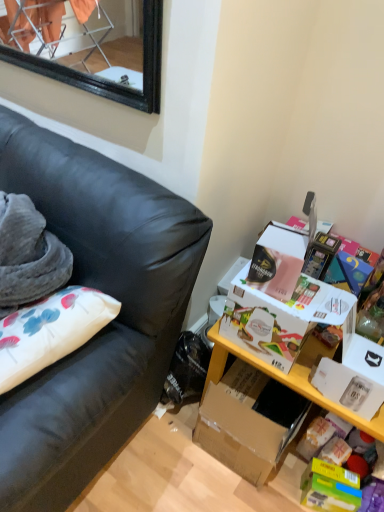
Describe the element at coordinates (106, 326) in the screenshot. Image resolution: width=384 pixels, height=512 pixels. I see `black leather couch at left` at that location.

You are a GUI agent. You are given a task and a screenshot of the screen. Output one action in this format:
    pyautogui.click(x=<x>, y=<y>)
    Task: Click on the white cardboard box at right
    Image resolution: width=384 pixels, height=512 pixels.
    Given the screenshot: What is the action you would take?
    pyautogui.click(x=280, y=317)

Is point (109, 281) closer or farther from the camera than point (254, 345)?

Clearly, point (109, 281) is closer to the camera than point (254, 345).

Is white cardboard box at right inside black leather couch at left?

No.

This screenshot has height=512, width=384. What are the coordinates of `storage box that appears below the black leather couch at left (from the image's perspective)` in the screenshot? It's located at (280, 317).

Is black leather couch at left oriented towards white cardboard box at right?

No, black leather couch at left is not facing towards white cardboard box at right.

Do you think black leather couch at left is within yellow wood table at lower right, or outside of it?

The correct answer is: outside.

Locate an element on the screen. This screenshot has height=512, width=384. table that is below the black leather couch at left (from the image's perspective) is located at coordinates (285, 382).

From the image's perspective, would you say black leather couch at left is shown under yellow wood table at lower right?

Incorrect, from the image's perspective, black leather couch at left is higher than yellow wood table at lower right.

Considering the positions of point (252, 340) and point (217, 353), is point (252, 340) closer or farther from the camera than point (217, 353)?

Point (252, 340) is closer to the camera than point (217, 353).

Considering the relative positions of white cardboard box at right and yellow wood table at lower right in the image provided, is white cardboard box at right to the left of yellow wood table at lower right from the viewer's perspective?

Indeed, white cardboard box at right is positioned on the left side of yellow wood table at lower right.

Is white cardboard box at right completely or partially outside of yellow wood table at lower right?

Yes, white cardboard box at right is outside of yellow wood table at lower right.

Are white cardboard box at right and black leather couch at left beside each other?

white cardboard box at right and black leather couch at left are clearly separated.

From a real-world perspective, is white cardboard box at right physically above black leather couch at left?

Yes, from a real-world perspective, white cardboard box at right is on top of black leather couch at left.

Considering the positions of objects white cardboard box at right and black leather couch at left in the image provided, who is behind, white cardboard box at right or black leather couch at left?

white cardboard box at right is further from the camera.

From the image's perspective, is white cardboard box at right on top of black leather couch at left?

No, from the image's perspective, white cardboard box at right is not over black leather couch at left.

Would you say yellow wood table at lower right is to the left or to the right of white cardboard box at right in the picture?

Clearly, yellow wood table at lower right is on the right of white cardboard box at right in the image.

In terms of width, does yellow wood table at lower right look wider or thinner when compared to white cardboard box at right?

Considering their sizes, yellow wood table at lower right looks broader than white cardboard box at right.

Locate an element on the screen. The height and width of the screenshot is (512, 384). table that is in front of the white cardboard box at right is located at coordinates (285, 382).

Is point (270, 469) behind point (345, 301)?

Yes, point (270, 469) is farther from viewer.

From the image's perspective, between yellow wood table at lower right and black leather couch at left, who is located below?

From the image's view, yellow wood table at lower right is below.

Which of these two, yellow wood table at lower right or black leather couch at left, is bigger?

black leather couch at left.

In the scene shown: Considering the sizes of objects yellow wood table at lower right and black leather couch at left in the image provided, who is taller, yellow wood table at lower right or black leather couch at left?

Standing taller between the two is black leather couch at left.

Identify the location of storage box located above the black leather couch at left (from a real-world perspective). (280, 317).

I want to click on studio couch lying above the yellow wood table at lower right (from the image's perspective), so (106, 326).

Estimate the real-world distances between objects in this image. Which object is further from yellow wood table at lower right, black leather couch at left or white cardboard box at right?

black leather couch at left is positioned further to the anchor yellow wood table at lower right.

Considering their positions, is yellow wood table at lower right positioned closer to black leather couch at left than white cardboard box at right?

The object closer to black leather couch at left is white cardboard box at right.

When comparing their distances from black leather couch at left, does white cardboard box at right or yellow wood table at lower right seem further?

yellow wood table at lower right is positioned further to the anchor black leather couch at left.

Estimate the real-world distances between objects in this image. Which object is further from white cardboard box at right, yellow wood table at lower right or black leather couch at left?

black leather couch at left lies further to white cardboard box at right than the other object.

Based on their spatial positions, is white cardboard box at right or black leather couch at left further from yellow wood table at lower right?

Among the two, black leather couch at left is located further to yellow wood table at lower right.

Which object lies nearer to the anchor point white cardboard box at right, black leather couch at left or yellow wood table at lower right?

Based on the image, yellow wood table at lower right appears to be nearer to white cardboard box at right.

The width and height of the screenshot is (384, 512). In order to click on storage box located between black leather couch at left and yellow wood table at lower right in the left-right direction in this screenshot , I will do `click(280, 317)`.